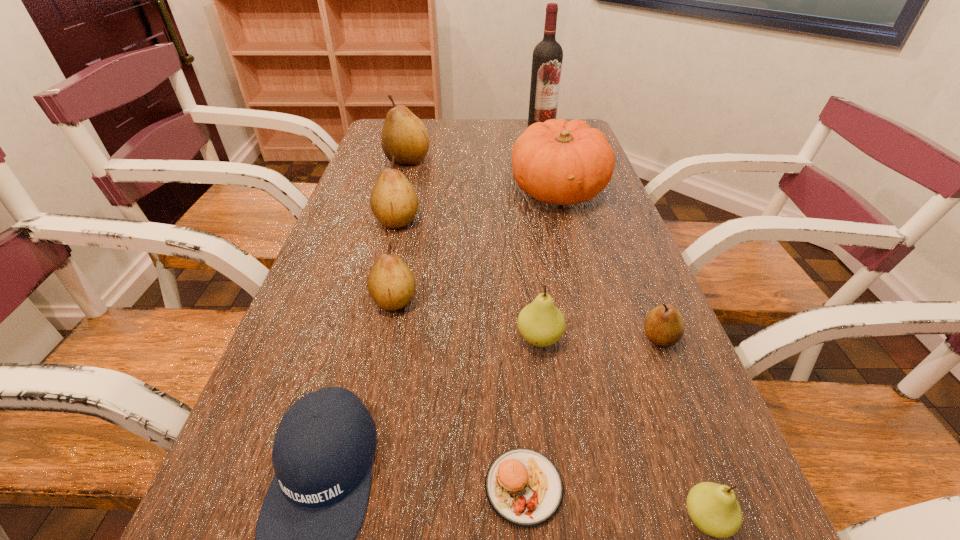
Find the location of a particular element. The width and height of the screenshot is (960, 540). free space between the fourth nearest pear and the tallest object is located at coordinates (468, 214).

I want to click on free space between the tallest pear and the third biggest brown pear, so [x=400, y=230].

Where is `empty location between the rightmost brown pear and the farther green pear`? Image resolution: width=960 pixels, height=540 pixels. empty location between the rightmost brown pear and the farther green pear is located at coordinates (600, 339).

Where is `empty space between the third farthest brown pear and the pumpkin`? This screenshot has height=540, width=960. empty space between the third farthest brown pear and the pumpkin is located at coordinates (476, 246).

Select which object appears as the fourth closest to the right green pear. Please provide its 2D coordinates. Your answer should be formatted as a tuple, i.e. [(x, y)], where the tuple contains the x and y coordinates of a point satisfying the conditions above.

[(322, 454)]

Locate which object is the closest to the third nearest brown pear. Please provide its 2D coordinates. Your answer should be formatted as a tuple, i.e. [(x, y)], where the tuple contains the x and y coordinates of a point satisfying the conditions above.

[(391, 284)]

Choose which pear is the second nearest neighbor to the farthest brown pear. Please provide its 2D coordinates. Your answer should be formatted as a tuple, i.e. [(x, y)], where the tuple contains the x and y coordinates of a point satisfying the conditions above.

[(391, 284)]

Locate which pear is the second closest to the nearest brown pear. Please provide its 2D coordinates. Your answer should be formatted as a tuple, i.e. [(x, y)], where the tuple contains the x and y coordinates of a point satisfying the conditions above.

[(713, 508)]

Point out which brown pear is positioned as the fourth nearest to the nearer green pear. Please provide its 2D coordinates. Your answer should be formatted as a tuple, i.e. [(x, y)], where the tuple contains the x and y coordinates of a point satisfying the conditions above.

[(403, 135)]

Identify which brown pear is the closest to the bigger green pear. Please provide its 2D coordinates. Your answer should be formatted as a tuple, i.e. [(x, y)], where the tuple contains the x and y coordinates of a point satisfying the conditions above.

[(664, 326)]